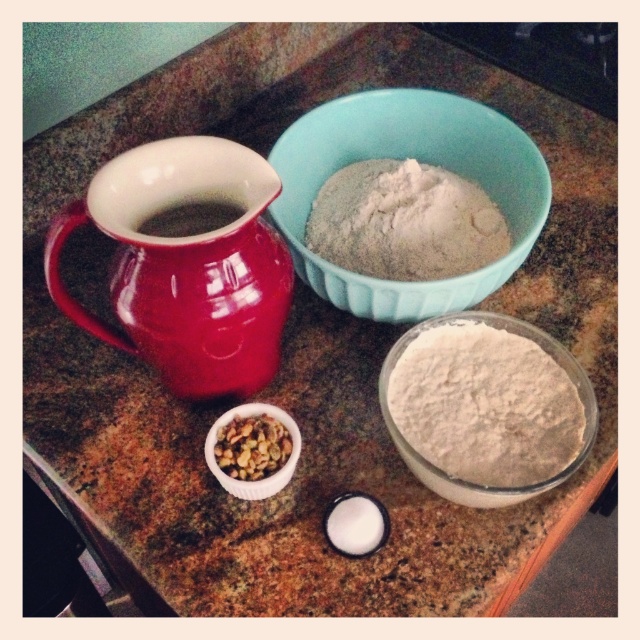
Question: Does blue ceramic bowl at upper center have a lesser width compared to brown textured nuts at center?

Choices:
 (A) no
 (B) yes

Answer: (A)

Question: Which object is closer to the camera taking this photo?

Choices:
 (A) white powder at upper center
 (B) matte ceramic jug at left

Answer: (B)

Question: Among these objects, which one is farthest from the camera?

Choices:
 (A) blue ceramic bowl at upper center
 (B) white powdery flour at center
 (C) brown textured nuts at center

Answer: (A)

Question: Which of these objects is positioned closest to the brown textured nuts at center?

Choices:
 (A) matte ceramic jug at left
 (B) blue ceramic bowl at upper center
 (C) white powdery flour at center

Answer: (A)

Question: Does matte ceramic jug at left have a greater width compared to blue ceramic bowl at upper center?

Choices:
 (A) yes
 (B) no

Answer: (B)

Question: Can you confirm if white powder at upper center is thinner than brown textured nuts at center?

Choices:
 (A) no
 (B) yes

Answer: (A)